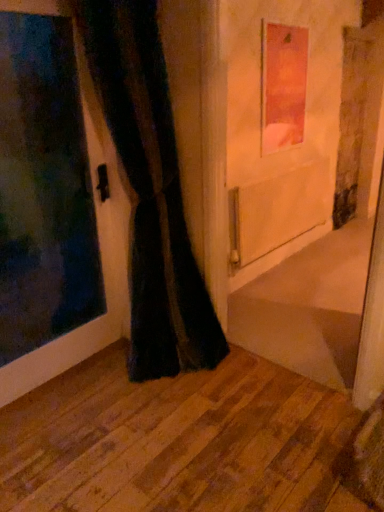
Question: Does matte pink picture frame at upper center turn towards wooden floor at lower left?

Choices:
 (A) yes
 (B) no

Answer: (B)

Question: Is matte pink picture frame at upper center taller than wooden floor at lower left?

Choices:
 (A) yes
 (B) no

Answer: (A)

Question: Is matte pink picture frame at upper center positioned beyond the bounds of wooden floor at lower left?

Choices:
 (A) no
 (B) yes

Answer: (B)

Question: From the image's perspective, is matte pink picture frame at upper center under wooden floor at lower left?

Choices:
 (A) yes
 (B) no

Answer: (B)

Question: Considering the relative positions of matte pink picture frame at upper center and wooden floor at lower left in the image provided, is matte pink picture frame at upper center behind wooden floor at lower left?

Choices:
 (A) no
 (B) yes

Answer: (B)

Question: Is matte pink picture frame at upper center with wooden floor at lower left?

Choices:
 (A) no
 (B) yes

Answer: (A)

Question: Considering the relative sizes of wooden floor at lower left and matte pink picture frame at upper center in the image provided, is wooden floor at lower left shorter than matte pink picture frame at upper center?

Choices:
 (A) yes
 (B) no

Answer: (A)

Question: Is the depth of wooden floor at lower left less than that of matte pink picture frame at upper center?

Choices:
 (A) yes
 (B) no

Answer: (A)

Question: Is wooden floor at lower left facing towards matte pink picture frame at upper center?

Choices:
 (A) yes
 (B) no

Answer: (B)

Question: Is wooden floor at lower left with matte pink picture frame at upper center?

Choices:
 (A) yes
 (B) no

Answer: (B)

Question: Can we say wooden floor at lower left lies outside matte pink picture frame at upper center?

Choices:
 (A) no
 (B) yes

Answer: (B)

Question: Is wooden floor at lower left positioned behind matte pink picture frame at upper center?

Choices:
 (A) no
 (B) yes

Answer: (A)

Question: Relative to wooden floor at lower left, is matte pink picture frame at upper center in front or behind?

Choices:
 (A) front
 (B) behind

Answer: (B)